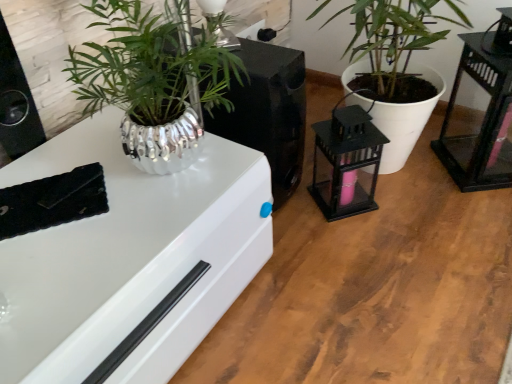
At what (x,y) coordinates should I click in order to perform the action: click on free area below black metal lantern at center-right, acting as the 2th appliance starting from the left (from a real-world perspective). Please return your answer as a coordinate pair (x, y). Looking at the image, I should click on (340, 208).